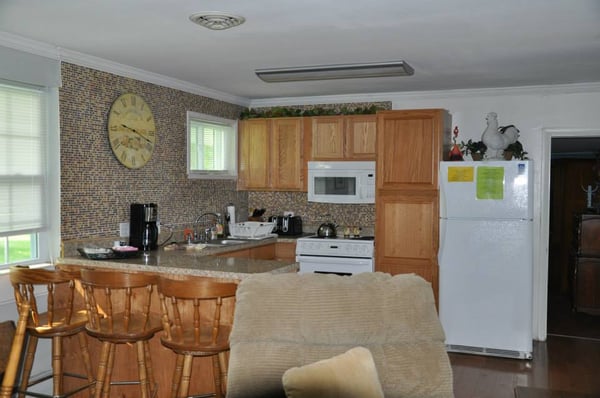
Find the location of `cabinets`. cabinets is located at coordinates (280, 140), (259, 141), (336, 134), (394, 137), (409, 222).